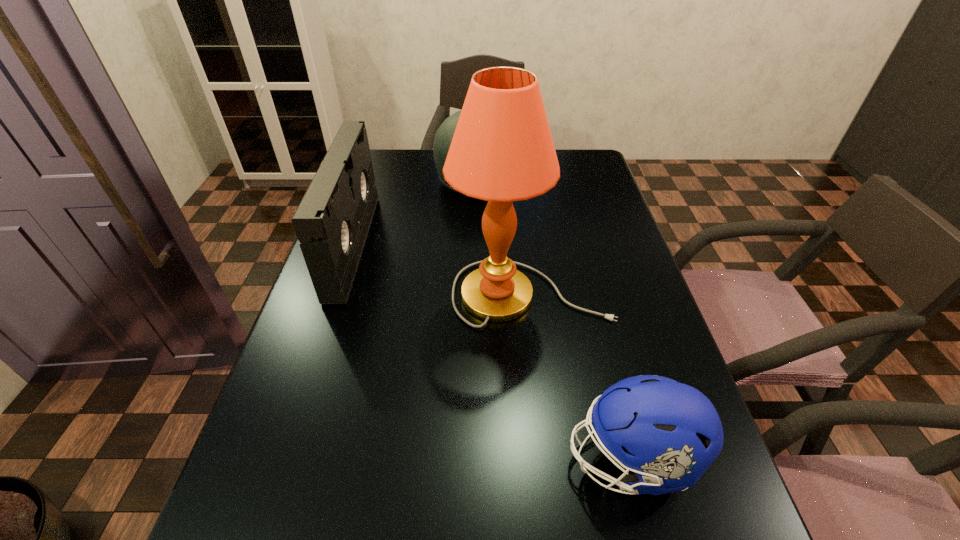
Find the location of a particular element. The height and width of the screenshot is (540, 960). free space located 0.170m on the face guard of the nearest object is located at coordinates (467, 459).

You are a GUI agent. You are given a task and a screenshot of the screen. Output one action in this format:
    pyautogui.click(x=<x>, y=<y>)
    Task: Click on the free location located 0.270m on the face guard of the nearest object
    
    Given the screenshot: What is the action you would take?
    pyautogui.click(x=407, y=459)

The image size is (960, 540). Find the location of `object positioned at the far edge`. object positioned at the far edge is located at coordinates (444, 135).

Identify the location of object present at the left edge. The height and width of the screenshot is (540, 960). (332, 221).

The height and width of the screenshot is (540, 960). In order to click on lamp that is at the right edge in this screenshot , I will do `click(502, 150)`.

Identify the location of football helmet situated at the right edge. point(668,433).

In the image, there is a desktop. Where is `free space at the far edge`? Image resolution: width=960 pixels, height=540 pixels. free space at the far edge is located at coordinates (430, 150).

Where is `vacant space at the left edge of the desktop`? vacant space at the left edge of the desktop is located at coordinates (353, 319).

This screenshot has width=960, height=540. In the image, there is a desktop. Find the location of `vacant space at the right edge`. vacant space at the right edge is located at coordinates (605, 226).

Locate an element on the screen. The height and width of the screenshot is (540, 960). vacant area at the far right corner of the desktop is located at coordinates (566, 166).